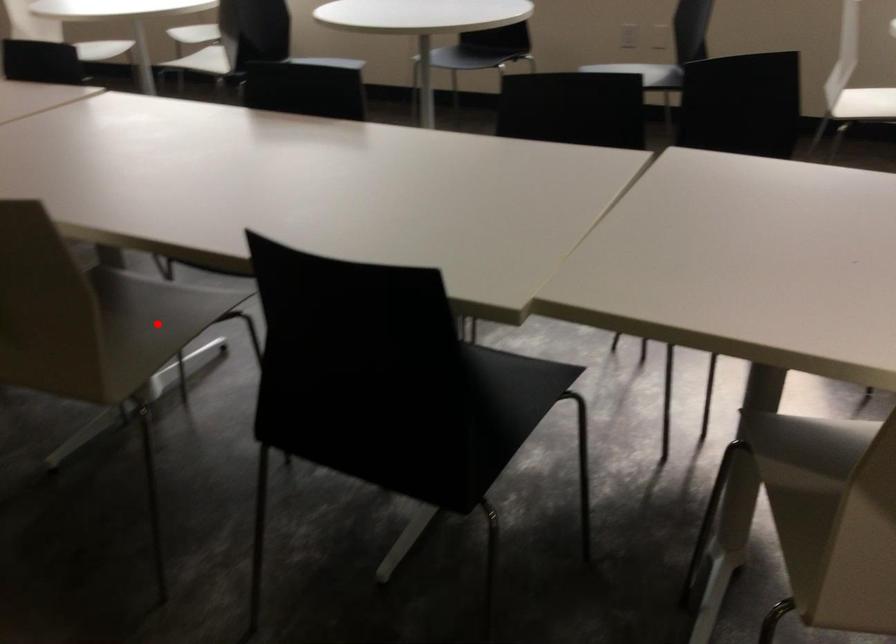
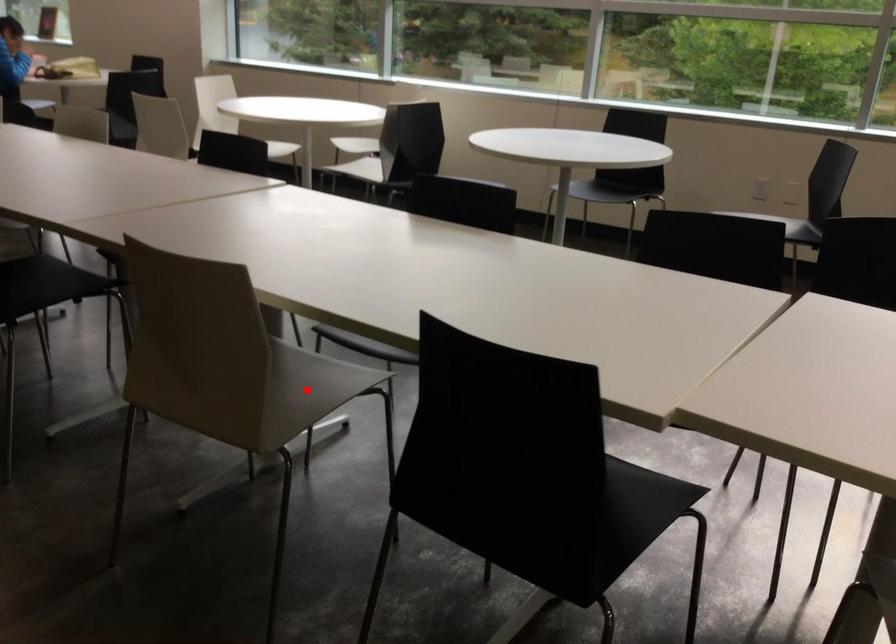
I am providing you with two images of the same scene from different viewpoints. A red point is marked on the first image and another point is marked on the second image. Is the red point in image1 aligned with the point shown in image2?

Yes